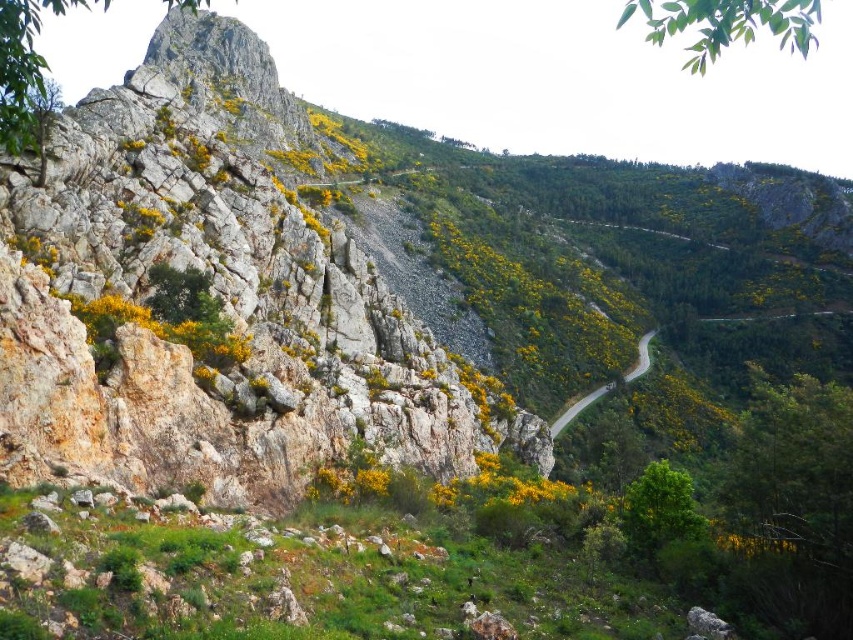
Can you confirm if rugged stone mountain at left is thinner than smooth asphalt road at center?

In fact, rugged stone mountain at left might be wider than smooth asphalt road at center.

Is rugged stone mountain at left bigger than smooth asphalt road at center?

Yes.

Between point (241, 388) and point (592, 390), which one is positioned behind?

Point (592, 390)

At what (x,y) coordinates should I click in order to perform the action: click on rugged stone mountain at left. Please return your answer as a coordinate pair (x, y). The height and width of the screenshot is (640, 853). Looking at the image, I should click on (212, 298).